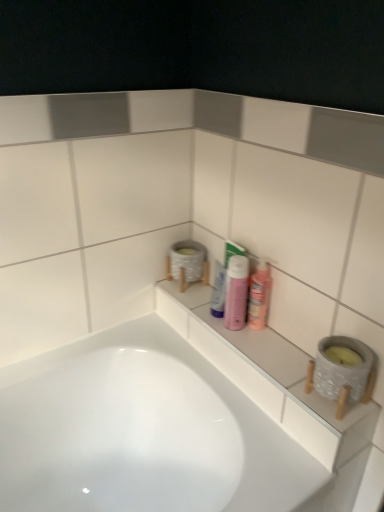
Where is `vacant area that is in front of white glossy tube at center, the 1th mouthwash from the left`? This screenshot has width=384, height=512. vacant area that is in front of white glossy tube at center, the 1th mouthwash from the left is located at coordinates (250, 347).